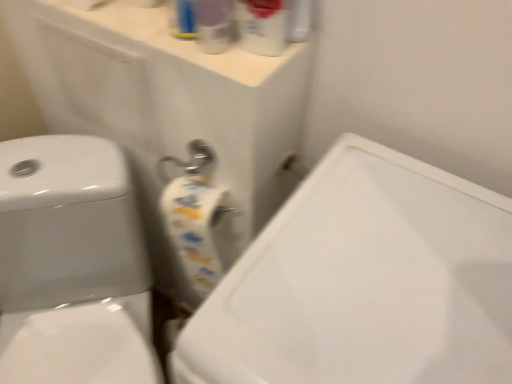
Where is `free space above white glossy sink at center (from a real-world perspective)`? The width and height of the screenshot is (512, 384). free space above white glossy sink at center (from a real-world perspective) is located at coordinates (402, 272).